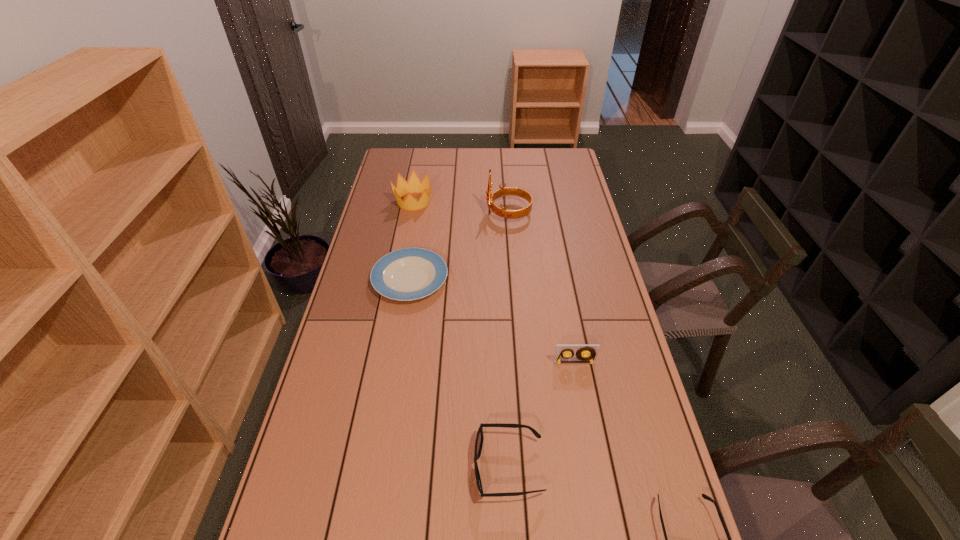
Where is `vacant space located 0.240m on the front-facing side of the left sunglasses`? The width and height of the screenshot is (960, 540). vacant space located 0.240m on the front-facing side of the left sunglasses is located at coordinates [376, 467].

Locate an element on the screen. This screenshot has height=540, width=960. vacant space situated on the right of the crown is located at coordinates (485, 202).

Find the location of a particular element. This screenshot has height=540, width=960. free space located at the front of the videotape with visible reels is located at coordinates (594, 470).

Image resolution: width=960 pixels, height=540 pixels. In order to click on free point located 0.140m on the front-facing side of the tallest object in this screenshot , I will do `click(452, 213)`.

This screenshot has width=960, height=540. Identify the location of free space located 0.080m on the front-facing side of the tallest object. (467, 213).

Image resolution: width=960 pixels, height=540 pixels. Identify the location of vacant point located on the front-facing side of the tallest object. (438, 213).

Find the location of a particular element. This screenshot has height=540, width=960. vacant area located on the back of the plate is located at coordinates 416,246.

I want to click on object present at the near edge, so click(x=479, y=438).

Locate an element on the screen. This screenshot has width=960, height=540. crown at the left edge is located at coordinates (414, 185).

The image size is (960, 540). Identify the location of plate situated at the left edge. (407, 274).